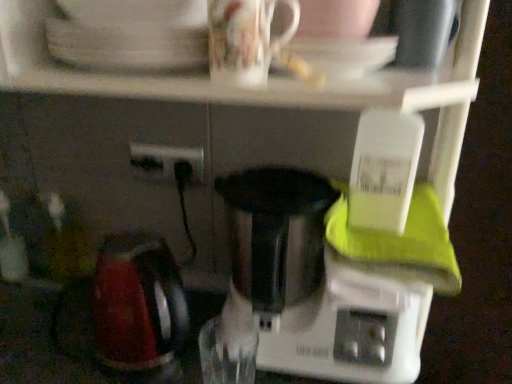
Question: Should I look upward or downward to see black plastic power plugs and sockets at center?

Choices:
 (A) up
 (B) down

Answer: (A)

Question: Is white plastic mixer at center located outside black plastic power plugs and sockets at center?

Choices:
 (A) yes
 (B) no

Answer: (A)

Question: From the image's perspective, is white plastic mixer at center over black plastic power plugs and sockets at center?

Choices:
 (A) no
 (B) yes

Answer: (A)

Question: From the image's perspective, is white plastic mixer at center beneath black plastic power plugs and sockets at center?

Choices:
 (A) yes
 (B) no

Answer: (A)

Question: Is white plastic mixer at center to the left of black plastic power plugs and sockets at center from the viewer's perspective?

Choices:
 (A) no
 (B) yes

Answer: (A)

Question: Can you confirm if white plastic mixer at center is positioned to the right of black plastic power plugs and sockets at center?

Choices:
 (A) no
 (B) yes

Answer: (B)

Question: From a real-world perspective, does white plastic mixer at center stand above black plastic power plugs and sockets at center?

Choices:
 (A) no
 (B) yes

Answer: (A)

Question: Is white plastic mixer at center directly adjacent to white glossy saucer at upper center?

Choices:
 (A) no
 (B) yes

Answer: (A)

Question: From the image's perspective, does white plastic mixer at center appear higher than white glossy saucer at upper center?

Choices:
 (A) yes
 (B) no

Answer: (B)

Question: Can you confirm if white plastic mixer at center is thinner than white glossy saucer at upper center?

Choices:
 (A) yes
 (B) no

Answer: (B)

Question: Does white plastic mixer at center appear on the left side of white glossy saucer at upper center?

Choices:
 (A) yes
 (B) no

Answer: (A)

Question: Does white plastic mixer at center have a lesser height compared to white glossy saucer at upper center?

Choices:
 (A) yes
 (B) no

Answer: (B)

Question: From the image's perspective, is white plastic mixer at center below white glossy saucer at upper center?

Choices:
 (A) no
 (B) yes

Answer: (B)

Question: From the image's perspective, is black plastic power plugs and sockets at center located beneath white glossy saucer at upper center?

Choices:
 (A) no
 (B) yes

Answer: (B)